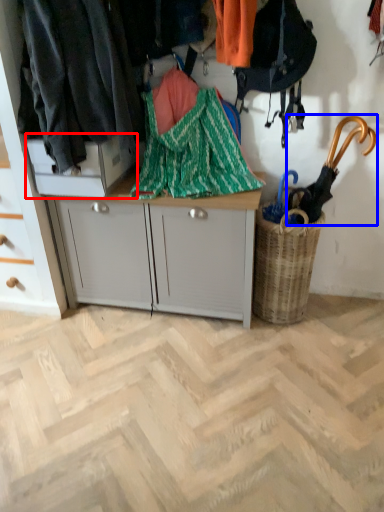
Question: Which point is further to the camera, cabinetry (highlighted by a red box) or umbrella (highlighted by a blue box)?

Choices:
 (A) cabinetry
 (B) umbrella

Answer: (A)